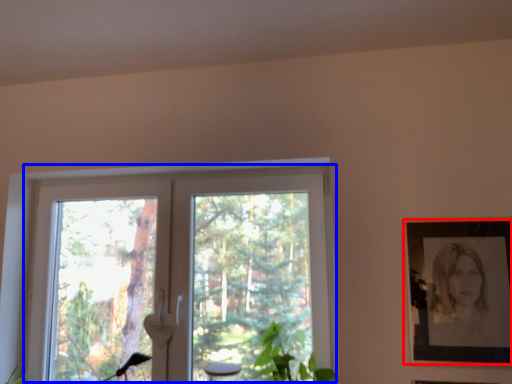
Question: Which point is closer to the camera, picture frame (highlighted by a red box) or window (highlighted by a blue box)?

Choices:
 (A) picture frame
 (B) window

Answer: (A)